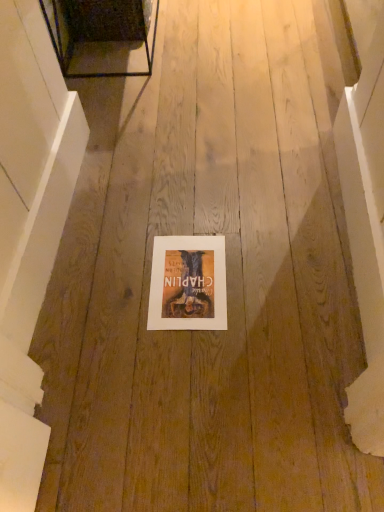
Find the location of a particular element. The height and width of the screenshot is (512, 384). blank space situated above matte paper picture frame at center (from a real-world perspective) is located at coordinates (184, 275).